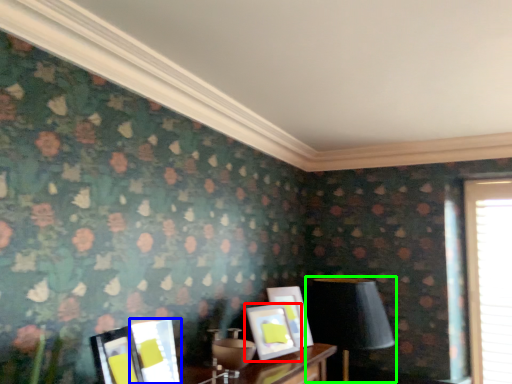
Question: Which object is the closest to the picture frame (highlighted by a red box)? Choose among these: picture frame (highlighted by a blue box) or table lamp (highlighted by a green box).

Choices:
 (A) picture frame
 (B) table lamp

Answer: (B)